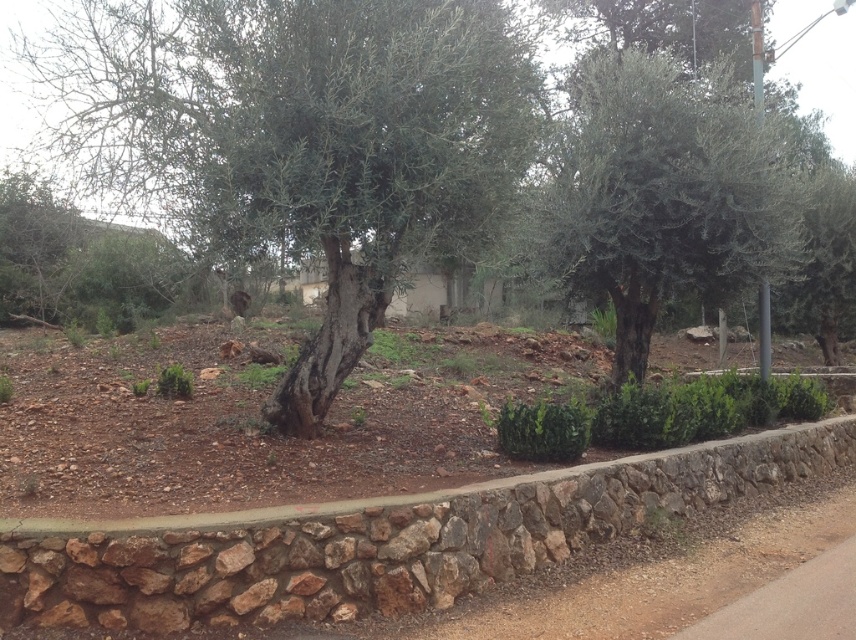
You are standing in front of the two trees in the scene. Which tree, the green rough bark tree at center or the green leafy olive tree at center, is closer to you?

The green rough bark tree at center is closer to the viewer than the green leafy olive tree at center.

You are a gardener planning to plant a new tree in the center of this rustic outdoor scene. There are two existing trees already at the center. Which tree, the green rough bark tree at center or the green leafy olive tree at center, should you consider removing to make space for the new tree?

The green rough bark tree at center is bigger than the green leafy olive tree at center, so you should consider removing the smaller one, the green leafy olive tree at center, to make space for the new tree.

You are a hiker who wants to take a photo of both the green rough bark tree at center and the green leafy olive tree at center. Since you want both trees to be fully visible in the photo, which tree should you stand closer to when taking the photo?

You should stand closer to the green leafy olive tree at center because it is shorter than the green rough bark tree at center, allowing both trees to be fully visible in the photo.